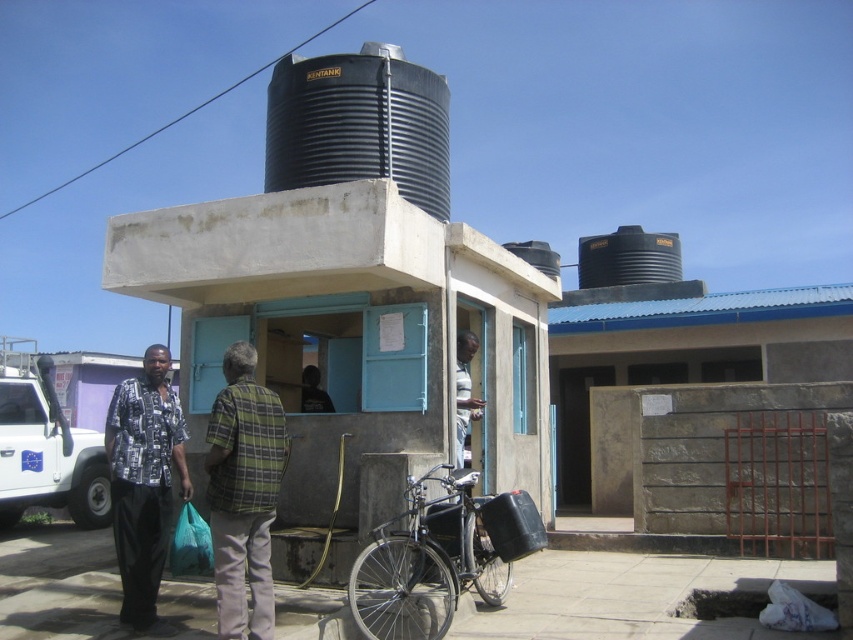
Question: Estimate the real-world distances between objects in this image. Which object is closer to the plaid shirt at center?

Choices:
 (A) shiny black bicycle at center
 (B) printed cotton shirt at left
 (C) green plaid shirt at center
 (D) black corrugated silo at upper center

Answer: (A)

Question: Can you confirm if printed cotton shirt at left is positioned above plaid shirt at center?

Choices:
 (A) no
 (B) yes

Answer: (A)

Question: Does green plaid shirt at center have a greater width compared to plaid shirt at center?

Choices:
 (A) yes
 (B) no

Answer: (A)

Question: Which object is the closest to the green plaid shirt at center?

Choices:
 (A) shiny black bicycle at center
 (B) printed cotton shirt at left

Answer: (A)

Question: Which of these objects is positioned farthest from the green plaid shirt at center?

Choices:
 (A) black corrugated silo at upper center
 (B) plaid shirt at center
 (C) printed cotton shirt at left

Answer: (A)

Question: Can you confirm if black corrugated silo at upper center is smaller than printed cotton shirt at left?

Choices:
 (A) no
 (B) yes

Answer: (B)